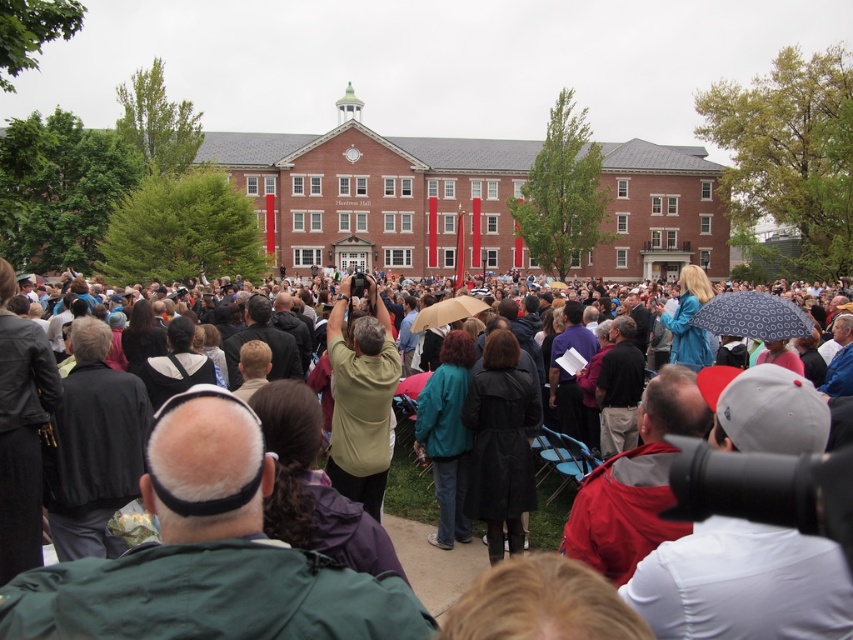
Which is more to the right, dark gray coat at center or matte green shirt at center?

From the viewer's perspective, dark gray coat at center appears more on the right side.

Between dark gray coat at center and matte green shirt at center, which one has more height?

With more height is dark gray coat at center.

Is point (550, 541) positioned behind point (338, 365)?

Yes, it is behind point (338, 365).

You are a GUI agent. You are given a task and a screenshot of the screen. Output one action in this format:
    pyautogui.click(x=<x>, y=<y>)
    Task: Click on the dark gray coat at center
    
    Given the screenshot: What is the action you would take?
    pyautogui.click(x=555, y=483)